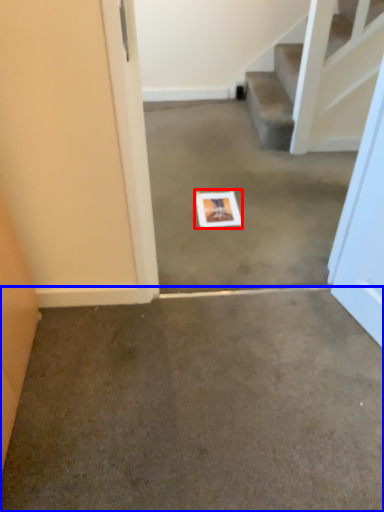
Question: Which point is closer to the camera, postcard (highlighted by a red box) or concrete (highlighted by a blue box)?

Choices:
 (A) postcard
 (B) concrete

Answer: (B)